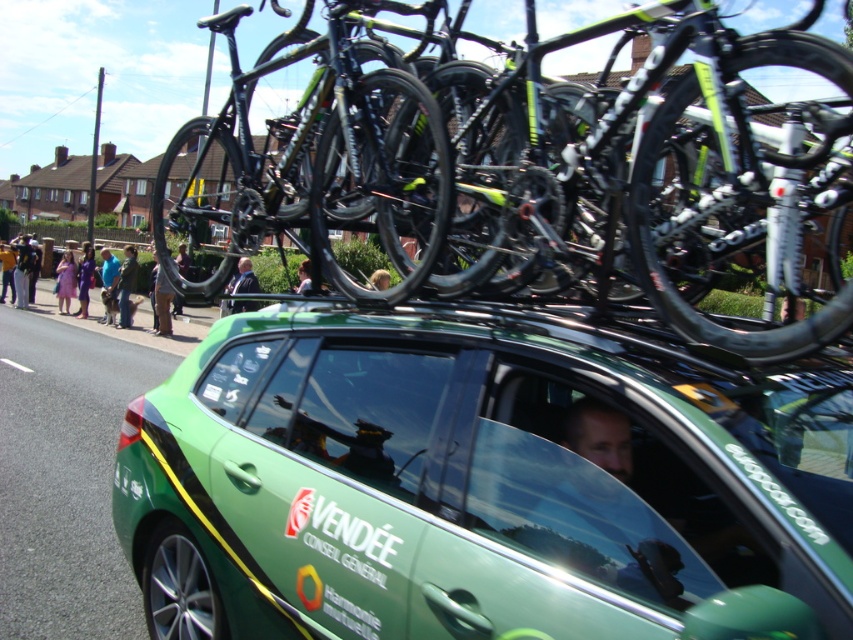
Is dark gray jacket at center above light purple dress at lower left?

Incorrect, dark gray jacket at center is not positioned above light purple dress at lower left.

Who is lower down, dark gray jacket at center or light purple dress at lower left?

dark gray jacket at center is below.

Locate an element on the screen. dark gray jacket at center is located at coordinates (244, 278).

Is green matte car at center above dark blue jeans at center?

Incorrect, green matte car at center is not positioned above dark blue jeans at center.

Does point (370, 518) come closer to viewer compared to point (132, 280)?

Yes, point (370, 518) is closer to viewer.

The width and height of the screenshot is (853, 640). What are the coordinates of `green matte car at center` in the screenshot? It's located at point(480,484).

Find the location of a particular element. This screenshot has width=853, height=640. green matte car at center is located at coordinates click(480, 484).

Based on the photo, does smooth skin face at center appear on the right side of blue denim jeans at lower left?

Yes, smooth skin face at center is to the right of blue denim jeans at lower left.

Does smooth skin face at center have a larger size compared to blue denim jeans at lower left?

Incorrect, smooth skin face at center is not larger than blue denim jeans at lower left.

Is point (643, 541) positioned in front of point (103, 268)?

Yes, point (643, 541) is in front of point (103, 268).

Identify the location of smooth skin face at center. This screenshot has width=853, height=640. (607, 504).